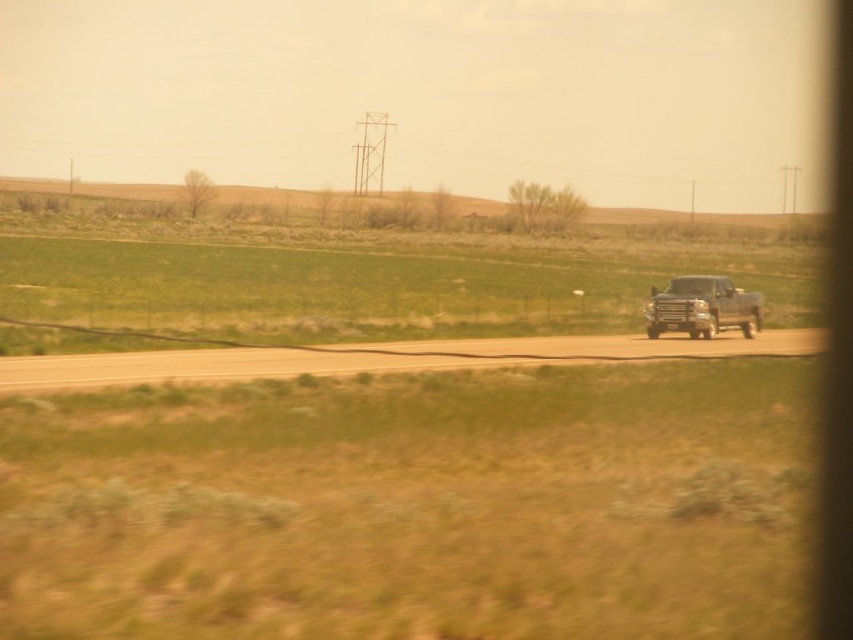
Measure the distance between smooth asphalt highway at center and metallic silver truck at right.

They are 28.55 feet apart.

Does point (738, 346) come closer to viewer compared to point (677, 285)?

Yes, it is.

Does point (291, 372) lie in front of point (758, 316)?

That is True.

Find the location of `smooth asphalt highway at center`. smooth asphalt highway at center is located at coordinates (379, 358).